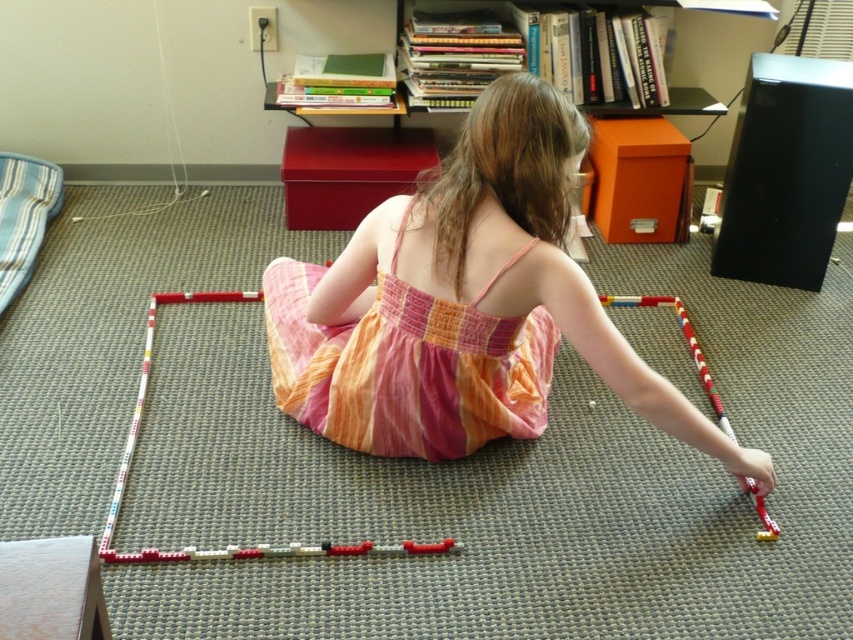
Question: Does pink cotton dress at center appear on the right side of translucent plastic toy at lower right?

Choices:
 (A) no
 (B) yes

Answer: (A)

Question: Among these points, which one is nearest to the camera?

Choices:
 (A) (291, 301)
 (B) (352, 444)
 (C) (703, 364)

Answer: (B)

Question: Can you confirm if multicolored fabric dress at center is positioned below translucent plastic toy at lower right?

Choices:
 (A) no
 (B) yes

Answer: (A)

Question: Can you confirm if pink cotton dress at center is smaller than translucent plastic toy at lower right?

Choices:
 (A) yes
 (B) no

Answer: (B)

Question: Which point appears closest to the camera in this image?

Choices:
 (A) (375, 266)
 (B) (659, 301)
 (C) (283, 371)

Answer: (A)

Question: Which object appears closest to the camera in this image?

Choices:
 (A) multicolored fabric dress at center
 (B) translucent plastic toy at lower right

Answer: (A)